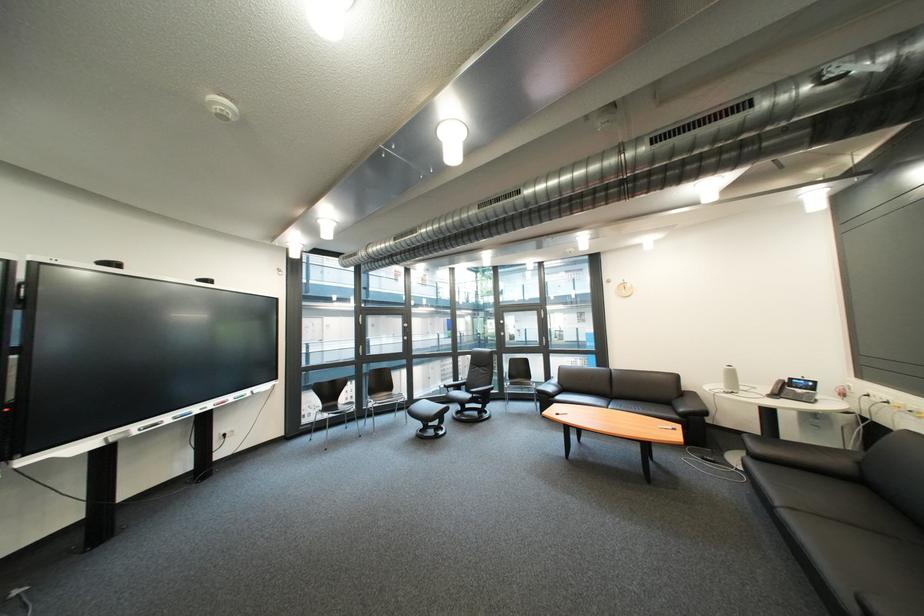
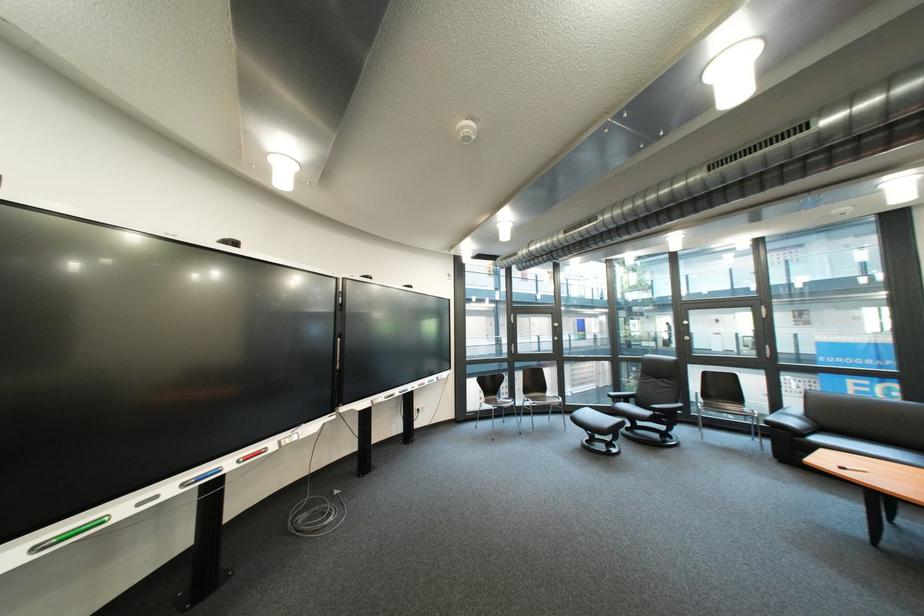
Where in the second image is the point corresponding to (471,382) from the first image?

(634, 392)